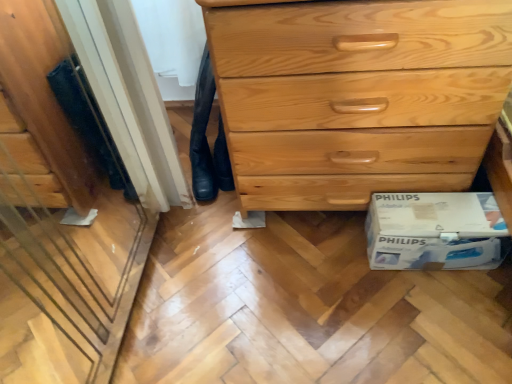
Question: Is black leather jeans at lower center thinner than white cardboard box at lower right?

Choices:
 (A) yes
 (B) no

Answer: (B)

Question: Does black leather jeans at lower center appear on the left side of white cardboard box at lower right?

Choices:
 (A) yes
 (B) no

Answer: (A)

Question: Is black leather jeans at lower center bigger than white cardboard box at lower right?

Choices:
 (A) no
 (B) yes

Answer: (A)

Question: Is white cardboard box at lower right at the back of black leather jeans at lower center?

Choices:
 (A) no
 (B) yes

Answer: (A)

Question: From the image's perspective, is black leather jeans at lower center under white cardboard box at lower right?

Choices:
 (A) yes
 (B) no

Answer: (B)

Question: Considering the relative positions of black leather jeans at lower center and white cardboard box at lower right in the image provided, is black leather jeans at lower center to the right of white cardboard box at lower right from the viewer's perspective?

Choices:
 (A) yes
 (B) no

Answer: (B)

Question: From the image's perspective, is black leather jeans at lower center below light wood chest of drawers at center?

Choices:
 (A) no
 (B) yes

Answer: (B)

Question: Is black leather jeans at lower center positioned with its back to light wood chest of drawers at center?

Choices:
 (A) yes
 (B) no

Answer: (B)

Question: Can you confirm if black leather jeans at lower center is thinner than light wood chest of drawers at center?

Choices:
 (A) yes
 (B) no

Answer: (A)

Question: Does black leather jeans at lower center turn towards light wood chest of drawers at center?

Choices:
 (A) no
 (B) yes

Answer: (A)

Question: Does black leather jeans at lower center touch light wood chest of drawers at center?

Choices:
 (A) no
 (B) yes

Answer: (A)

Question: Is black leather jeans at lower center positioned far away from light wood chest of drawers at center?

Choices:
 (A) yes
 (B) no

Answer: (B)

Question: Is there a large distance between white cardboard box at lower right and black leather jeans at lower center?

Choices:
 (A) no
 (B) yes

Answer: (A)